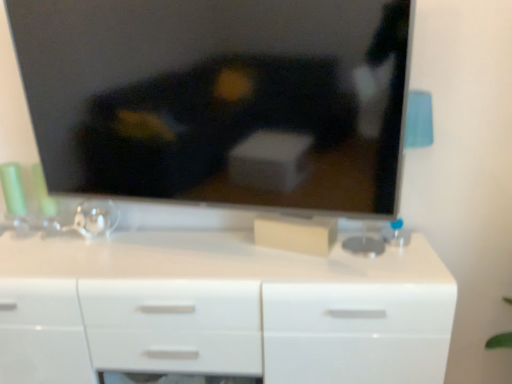
Image resolution: width=512 pixels, height=384 pixels. In order to click on vacant region above white glossy chest of drawers at center (from a real-world perspective) in this screenshot , I will do `click(225, 255)`.